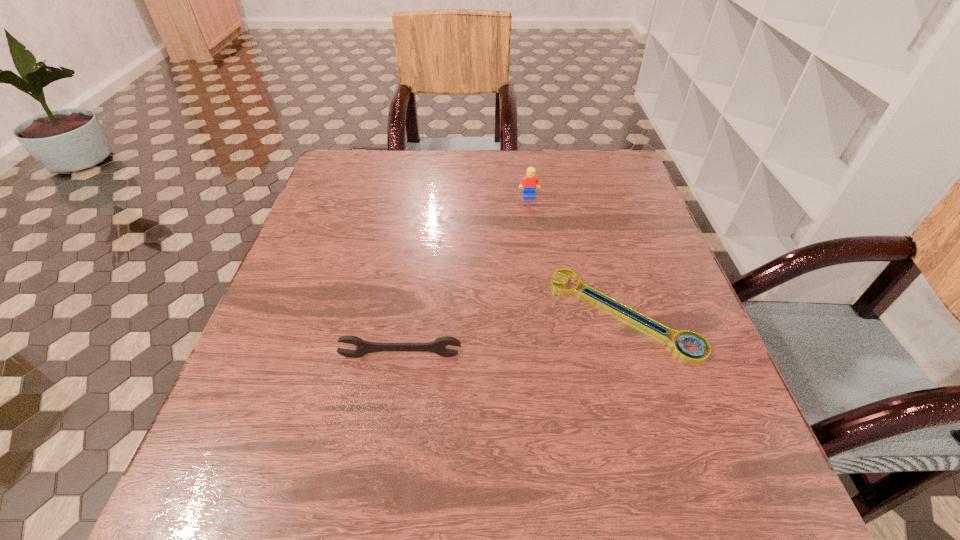
Locate an element on the screen. free space between the Lego and the taller wrench is located at coordinates [x=465, y=276].

I want to click on empty location between the taller wrench and the tallest object, so click(465, 276).

This screenshot has width=960, height=540. In order to click on free point between the shortest object and the farthest object in this screenshot , I will do `click(576, 255)`.

At what (x,y) coordinates should I click in order to perform the action: click on blank region between the leftmost object and the shorter wrench. Please return your answer as a coordinate pair (x, y). Image resolution: width=960 pixels, height=540 pixels. Looking at the image, I should click on (512, 335).

Identify the location of free space between the tallest object and the leftmost object. (465, 276).

Where is `empty space that is in between the taller wrench and the Lego`? The image size is (960, 540). empty space that is in between the taller wrench and the Lego is located at coordinates (465, 276).

The height and width of the screenshot is (540, 960). What are the coordinates of `vacant area between the left wrench and the right wrench` in the screenshot? It's located at (512, 335).

You are a GUI agent. You are given a task and a screenshot of the screen. Output one action in this format:
    pyautogui.click(x=<x>, y=<y>)
    Task: Click on the free spot between the Lego and the left wrench
    This screenshot has width=960, height=540.
    Given the screenshot: What is the action you would take?
    pyautogui.click(x=465, y=276)

Locate an element on the screen. This screenshot has width=960, height=540. vacant space in between the leftmost object and the shorter wrench is located at coordinates (512, 335).

Where is `object that stands as the second closest to the second shortest object`? object that stands as the second closest to the second shortest object is located at coordinates (528, 183).